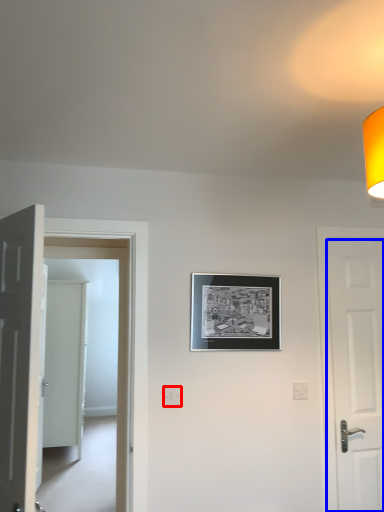
Question: Which object appears closest to the camera in this image, electric outlet (highlighted by a red box) or door (highlighted by a blue box)?

Choices:
 (A) electric outlet
 (B) door

Answer: (A)